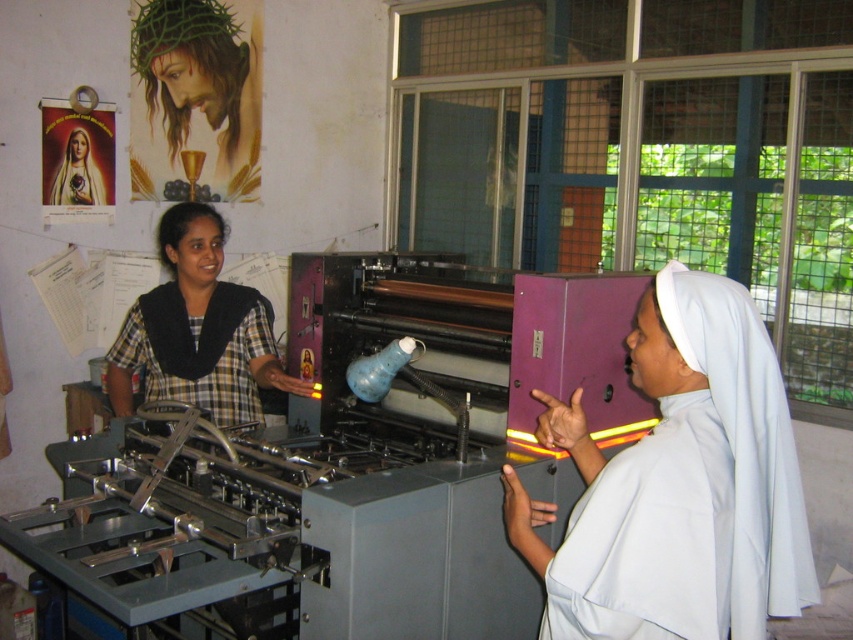
Who is shorter, white matte nun's habit at center or matte black blouse at center?

matte black blouse at center is shorter.

Is point (561, 412) closer to viewer compared to point (88, 150)?

Yes, point (561, 412) is in front of point (88, 150).

Image resolution: width=853 pixels, height=640 pixels. Identify the location of white matte nun's habit at center. (679, 484).

This screenshot has width=853, height=640. What do you see at coordinates (195, 99) in the screenshot?
I see `matte black nun at upper left` at bounding box center [195, 99].

Is point (207, 52) positioned after point (68, 141)?

Yes.

This screenshot has height=640, width=853. Identify the location of matte black nun at upper left. (195, 99).

I want to click on matte black nun at upper left, so click(195, 99).

Can you confirm if black checkered shirt at left is positioned above matte black blouse at center?

Incorrect, black checkered shirt at left is not positioned above matte black blouse at center.

Does black checkered shirt at left appear on the left side of matte black blouse at center?

No, black checkered shirt at left is not to the left of matte black blouse at center.

Is point (177, 320) more distant than point (68, 177)?

No, it is not.

This screenshot has width=853, height=640. Find the location of `black checkered shirt at left`. black checkered shirt at left is located at coordinates (198, 349).